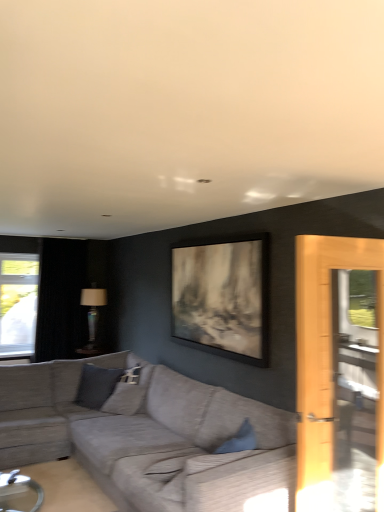
Question: From the image's perspective, is black velvet curtain at left located above or below textured gray couch at center?

Choices:
 (A) above
 (B) below

Answer: (A)

Question: Is black velvet curtain at left in front of or behind textured gray couch at center in the image?

Choices:
 (A) behind
 (B) front

Answer: (A)

Question: Which of these objects is positioned farthest from the gray fabric pillow at center?

Choices:
 (A) black velvet curtain at left
 (B) textured gray couch at center
 (C) matte glass lamp at center

Answer: (A)

Question: Estimate the real-world distances between objects in this image. Which object is closer to the black velvet curtain at left?

Choices:
 (A) matte glass lamp at center
 (B) gray fabric pillow at center
 (C) textured gray couch at center

Answer: (A)